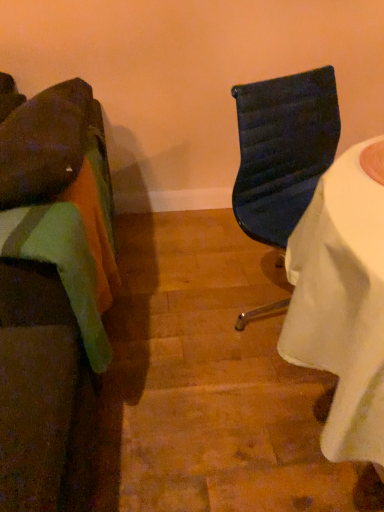
Question: Considering the positions of velvet green cushion at left, the 1th chair in the left-to-right sequence, and matte black chair at center, placed as the 1th chair when sorted from right to left, in the image, is velvet green cushion at left, the 1th chair in the left-to-right sequence, bigger or smaller than matte black chair at center, placed as the 1th chair when sorted from right to left,?

Choices:
 (A) big
 (B) small

Answer: (B)

Question: From the image's perspective, is velvet green cushion at left, the 1th chair in the left-to-right sequence, above or below matte black chair at center, which is the second chair from left to right?

Choices:
 (A) above
 (B) below

Answer: (B)

Question: Considering their positions, is velvet green cushion at left, the 1th chair in the left-to-right sequence, located in front of or behind matte black chair at center, placed as the 1th chair when sorted from right to left?

Choices:
 (A) front
 (B) behind

Answer: (A)

Question: In terms of height, does matte black chair at center, which is the second chair from left to right, look taller or shorter compared to velvet green cushion at left, marked as the 2th chair in a right-to-left arrangement?

Choices:
 (A) short
 (B) tall

Answer: (B)

Question: In the image, is matte black chair at center, placed as the 1th chair when sorted from right to left, positioned in front of or behind velvet green cushion at left, the 1th chair in the left-to-right sequence?

Choices:
 (A) behind
 (B) front

Answer: (A)

Question: In terms of width, does matte black chair at center, placed as the 1th chair when sorted from right to left, look wider or thinner when compared to velvet green cushion at left, the 1th chair in the left-to-right sequence?

Choices:
 (A) thin
 (B) wide

Answer: (A)

Question: From a real-world perspective, is matte black chair at center, which is the second chair from left to right, above or below velvet green cushion at left, marked as the 2th chair in a right-to-left arrangement?

Choices:
 (A) above
 (B) below

Answer: (A)